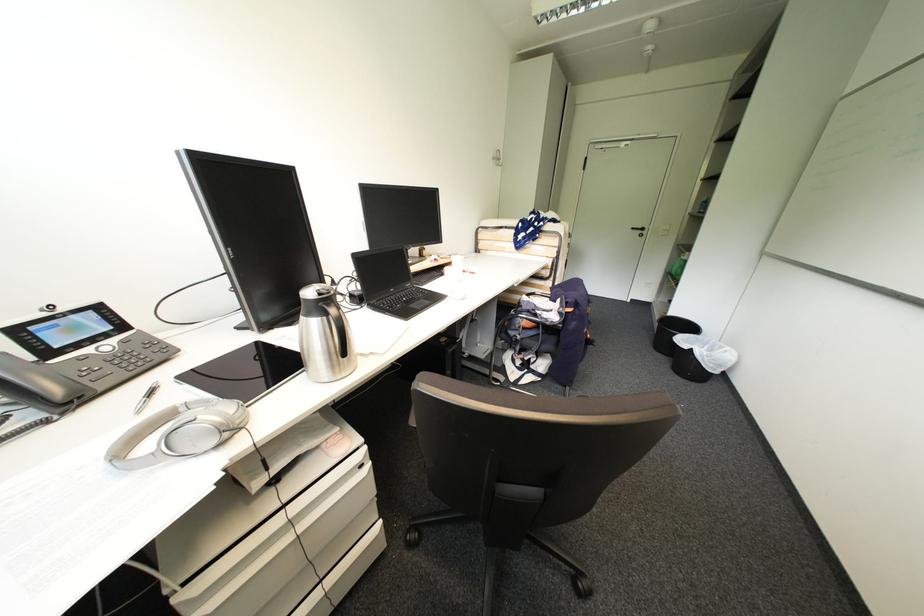
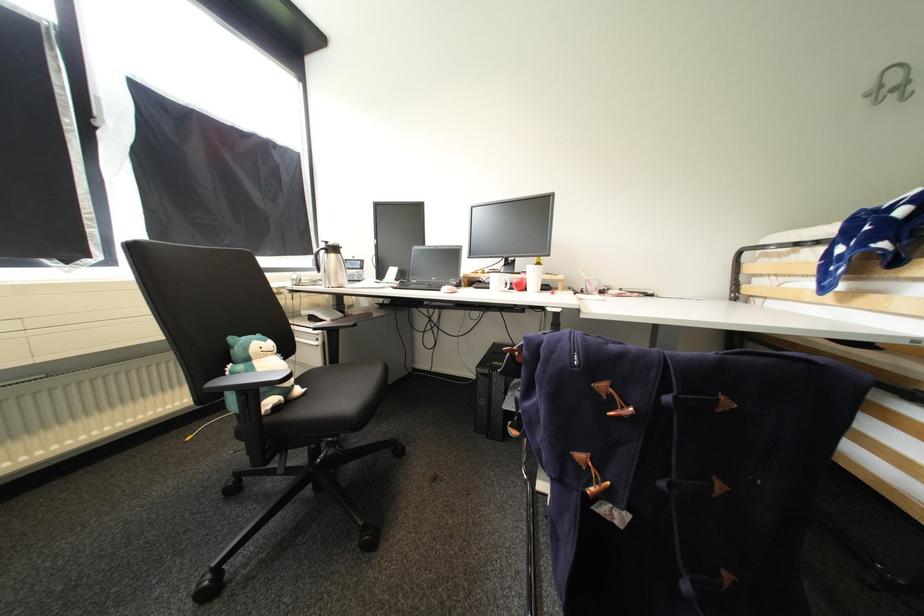
Locate, in the second image, the point that corresponds to point 505,160 in the first image.

(912, 84)